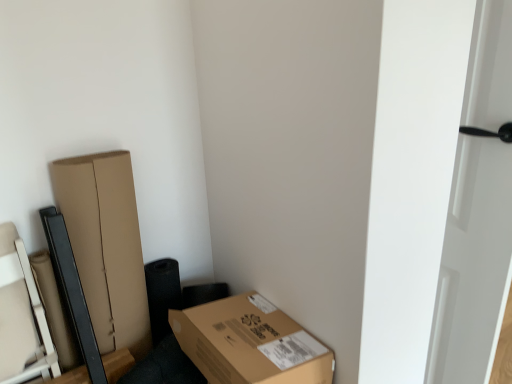
Question: Is brown cardboard box at lower right in front of or behind white glossy door at right in the image?

Choices:
 (A) front
 (B) behind

Answer: (B)

Question: From a real-world perspective, is brown cardboard box at lower right physically located above or below white glossy door at right?

Choices:
 (A) below
 (B) above

Answer: (A)

Question: Would you say brown cardboard box at lower right is inside or outside white glossy door at right?

Choices:
 (A) outside
 (B) inside

Answer: (A)

Question: Choose the correct answer: Is white glossy door at right inside brown cardboard box at lower right or outside it?

Choices:
 (A) outside
 (B) inside

Answer: (A)

Question: In terms of width, does white glossy door at right look wider or thinner when compared to brown cardboard box at lower right?

Choices:
 (A) wide
 (B) thin

Answer: (B)

Question: Is white glossy door at right in front of or behind brown cardboard box at lower right in the image?

Choices:
 (A) front
 (B) behind

Answer: (A)

Question: From the image's perspective, is white glossy door at right above or below brown cardboard box at lower right?

Choices:
 (A) below
 (B) above

Answer: (B)